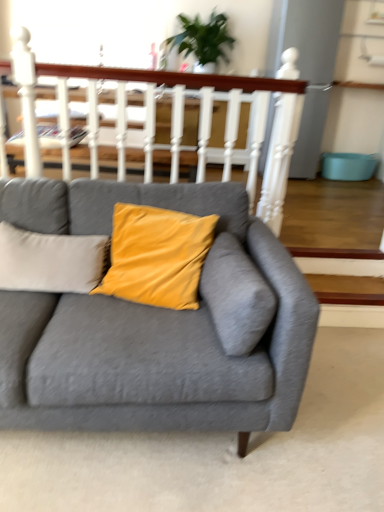
Question: Is matte gray couch at center completely or partially inside white wooden balustrade at upper center?

Choices:
 (A) yes
 (B) no

Answer: (B)

Question: From the image's perspective, is white wooden balustrade at upper center located above matte gray couch at center?

Choices:
 (A) yes
 (B) no

Answer: (A)

Question: Considering the relative sizes of white wooden balustrade at upper center and matte gray couch at center in the image provided, is white wooden balustrade at upper center thinner than matte gray couch at center?

Choices:
 (A) no
 (B) yes

Answer: (B)

Question: Is white wooden balustrade at upper center behind matte gray couch at center?

Choices:
 (A) no
 (B) yes

Answer: (B)

Question: Are white wooden balustrade at upper center and matte gray couch at center located far from each other?

Choices:
 (A) no
 (B) yes

Answer: (A)

Question: In terms of height, does velvet yellow pillow at center look taller or shorter compared to white wooden balustrade at upper center?

Choices:
 (A) short
 (B) tall

Answer: (A)

Question: Is velvet yellow pillow at center inside or outside of white wooden balustrade at upper center?

Choices:
 (A) outside
 (B) inside

Answer: (A)

Question: Is point (16, 261) positioned closer to the camera than point (261, 199)?

Choices:
 (A) closer
 (B) farther

Answer: (A)

Question: Is velvet yellow pillow at center in front of or behind white wooden balustrade at upper center in the image?

Choices:
 (A) behind
 (B) front

Answer: (B)

Question: Considering the positions of point (236, 134) and point (195, 52), is point (236, 134) closer or farther from the camera than point (195, 52)?

Choices:
 (A) farther
 (B) closer

Answer: (B)

Question: In terms of size, does white wooden balustrade at upper center appear bigger or smaller than green leafy plant at upper center?

Choices:
 (A) small
 (B) big

Answer: (A)

Question: Considering the positions of white wooden balustrade at upper center and green leafy plant at upper center in the image, is white wooden balustrade at upper center taller or shorter than green leafy plant at upper center?

Choices:
 (A) tall
 (B) short

Answer: (A)

Question: Is white wooden balustrade at upper center to the left or to the right of green leafy plant at upper center in the image?

Choices:
 (A) right
 (B) left

Answer: (B)

Question: Would you say velvet yellow pillow at center is inside or outside green leafy plant at upper center?

Choices:
 (A) outside
 (B) inside

Answer: (A)

Question: From the image's perspective, relative to green leafy plant at upper center, is velvet yellow pillow at center above or below?

Choices:
 (A) above
 (B) below

Answer: (B)